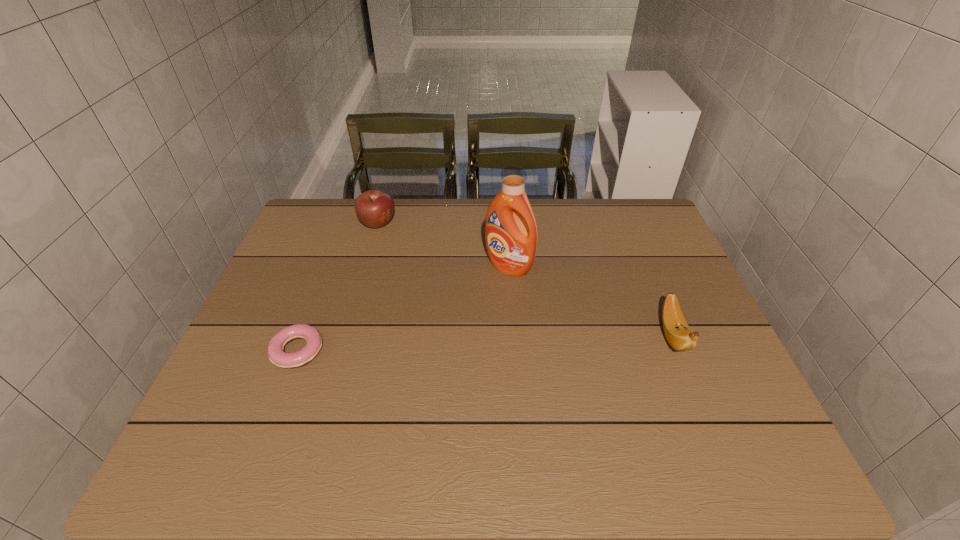
Identify the location of free space at the near left corner of the desktop. (211, 411).

Where is `free spot at the far right corner of the desktop`? free spot at the far right corner of the desktop is located at coordinates (626, 239).

This screenshot has width=960, height=540. In the image, there is a desktop. What are the coordinates of `vacant space at the near right corner` in the screenshot? It's located at (757, 415).

You are a GUI agent. You are given a task and a screenshot of the screen. Output one action in this format:
    pyautogui.click(x=<x>, y=<y>)
    Task: Click on the vacant area that lies between the farthest object and the second object from right to left
    
    Given the screenshot: What is the action you would take?
    pyautogui.click(x=444, y=245)

Where is `free spot between the apple and the banana`? The height and width of the screenshot is (540, 960). free spot between the apple and the banana is located at coordinates (525, 279).

The image size is (960, 540). Find the location of `vacant space in between the detergent and the apple`. vacant space in between the detergent and the apple is located at coordinates (444, 245).

You are a GUI agent. You are given a task and a screenshot of the screen. Output one action in this format:
    pyautogui.click(x=<x>, y=<y>)
    Task: Click on the empty space that is in between the shortest object and the tallest object
    
    Given the screenshot: What is the action you would take?
    [403, 309]

Where is `free space between the shortest object and the apple`? This screenshot has height=540, width=960. free space between the shortest object and the apple is located at coordinates (338, 287).

Image resolution: width=960 pixels, height=540 pixels. Identify the location of free space between the tallest object and the doughnut. (403, 309).

The width and height of the screenshot is (960, 540). I want to click on vacant space that's between the rightmost object and the apple, so click(525, 279).